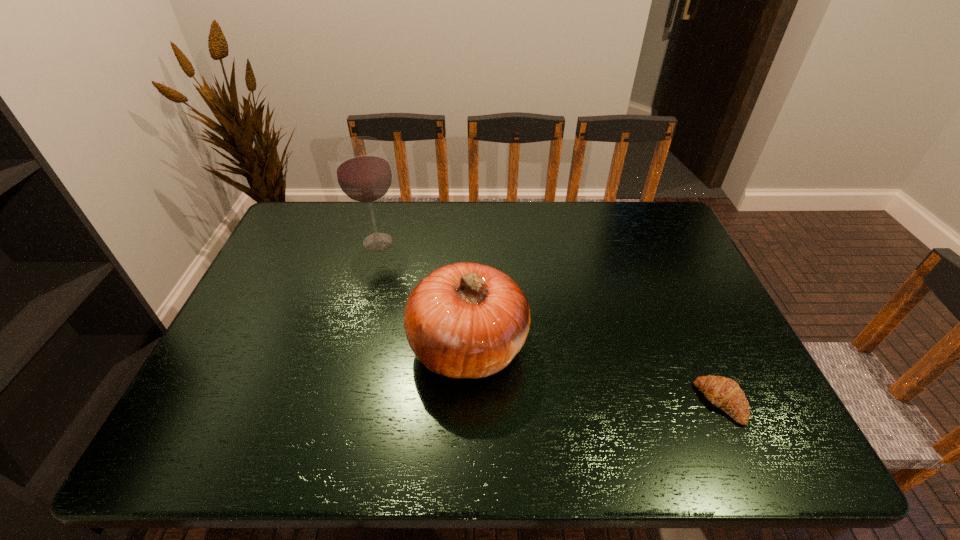
The image size is (960, 540). What are the coordinates of `free space between the shortest object and the pumpkin` in the screenshot? It's located at (594, 374).

Identify the location of free space between the shortest object and the second object from right to left. (594, 374).

Identify the location of unoccupied position between the shortest object and the farthest object. The image size is (960, 540). (549, 322).

This screenshot has width=960, height=540. Identify the location of free space between the pumpkin and the shortest object. [594, 374].

Locate an element on the screen. This screenshot has height=540, width=960. empty space between the alcohol and the rightmost object is located at coordinates (549, 322).

Image resolution: width=960 pixels, height=540 pixels. I want to click on the second closest object to the leftmost object, so click(724, 393).

You are a GUI agent. You are given a task and a screenshot of the screen. Output one action in this format:
    pyautogui.click(x=<x>, y=<y>)
    Task: Click on the closest object to the second shortest object
    
    Given the screenshot: What is the action you would take?
    pyautogui.click(x=364, y=175)

What are the coordinates of `free space that satisfies the following two spatial constraints: 1. on the front side of the second shortest object; 2. on the right side of the shortest object` in the screenshot? It's located at (467, 402).

What are the coordinates of `vacant space that satisfies the following two spatial constraints: 1. on the front side of the second object from left to right; 2. on the left side of the tallest object` in the screenshot? It's located at (349, 346).

Identify the location of blank area in the image that satisfies the following two spatial constraints: 1. on the front side of the leftmost object; 2. on the right side of the shortest object. (334, 402).